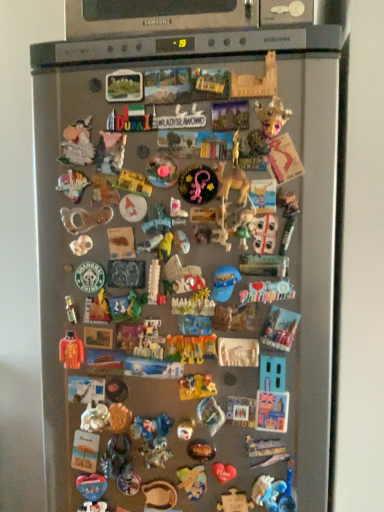
Question: From the image's perspective, is blue plastic toy at center, placed as the sixteenth toy when sorted from top to bottom, under white plastic toy at center, which ranks as the eighth toy in top-to-bottom order?

Choices:
 (A) no
 (B) yes

Answer: (B)

Question: Does blue plastic toy at center, placed as the sixteenth toy when sorted from top to bottom, have a greater width compared to white plastic toy at center, positioned as the 25th toy in bottom-to-top order?

Choices:
 (A) no
 (B) yes

Answer: (A)

Question: From a real-world perspective, is blue plastic toy at center, the seventeenth toy in the bottom-to-top sequence, over white plastic toy at center, positioned as the 25th toy in bottom-to-top order?

Choices:
 (A) yes
 (B) no

Answer: (B)

Question: Can you confirm if blue plastic toy at center, placed as the sixteenth toy when sorted from top to bottom, is shorter than white plastic toy at center, which ranks as the eighth toy in top-to-bottom order?

Choices:
 (A) no
 (B) yes

Answer: (A)

Question: Is the depth of blue plastic toy at center, the seventeenth toy in the bottom-to-top sequence, greater than that of white plastic toy at center, which ranks as the eighth toy in top-to-bottom order?

Choices:
 (A) yes
 (B) no

Answer: (B)

Question: Does blue plastic toy at center, placed as the sixteenth toy when sorted from top to bottom, contain white plastic toy at center, which ranks as the eighth toy in top-to-bottom order?

Choices:
 (A) yes
 (B) no

Answer: (B)

Question: Does matte blue heart at center, the 3th toy when ordered from bottom to top, turn towards blue plastic magnet at lower right, placed as the 14th toy when sorted from bottom to top?

Choices:
 (A) no
 (B) yes

Answer: (A)

Question: Considering the relative sizes of matte blue heart at center, which is counted as the 30th toy, starting from the top, and blue plastic magnet at lower right, acting as the nineteenth toy starting from the top, in the image provided, is matte blue heart at center, which is counted as the 30th toy, starting from the top, thinner than blue plastic magnet at lower right, acting as the nineteenth toy starting from the top,?

Choices:
 (A) no
 (B) yes

Answer: (A)

Question: Would you consider matte blue heart at center, the 3th toy when ordered from bottom to top, to be distant from blue plastic magnet at lower right, acting as the nineteenth toy starting from the top?

Choices:
 (A) no
 (B) yes

Answer: (A)

Question: Does matte blue heart at center, the 3th toy when ordered from bottom to top, lie behind blue plastic magnet at lower right, placed as the 14th toy when sorted from bottom to top?

Choices:
 (A) yes
 (B) no

Answer: (A)

Question: From the image's perspective, is matte blue heart at center, the 3th toy when ordered from bottom to top, beneath blue plastic magnet at lower right, acting as the nineteenth toy starting from the top?

Choices:
 (A) yes
 (B) no

Answer: (A)

Question: Is matte blue heart at center, the 3th toy when ordered from bottom to top, smaller than blue plastic magnet at lower right, acting as the nineteenth toy starting from the top?

Choices:
 (A) no
 (B) yes

Answer: (A)

Question: Is plastic toy at center, marked as the seventh toy in a bottom-to-top arrangement, shorter than shiny plastic toy at center, which ranks as the eighth toy in bottom-to-top order?

Choices:
 (A) yes
 (B) no

Answer: (B)